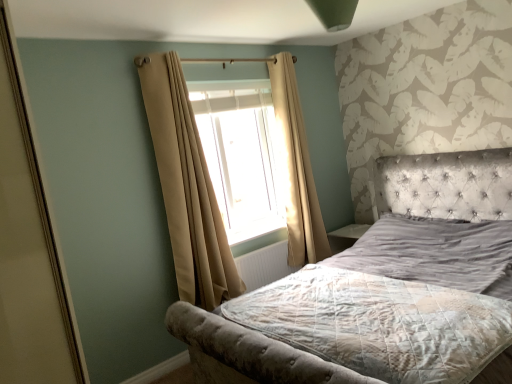
Question: From the image's perspective, is white textured radiator at center positioned above or below velvet grey bed at center?

Choices:
 (A) below
 (B) above

Answer: (A)

Question: Is white textured radiator at center taller or shorter than velvet grey bed at center?

Choices:
 (A) tall
 (B) short

Answer: (B)

Question: Which object is the farthest from the translucent fabric window at center?

Choices:
 (A) beige fabric curtain at left, which is counted as the 2th curtain, starting from the back
 (B) beige fabric curtain at center, which is counted as the first curtain, starting from the back
 (C) textured gray mattress at center
 (D) white textured radiator at center
 (E) velvet grey bed at center

Answer: (C)

Question: Estimate the real-world distances between objects in this image. Which object is farther from the velvet grey bed at center?

Choices:
 (A) beige fabric curtain at left, the 2th curtain from the right
 (B) textured gray mattress at center
 (C) translucent fabric window at center
 (D) white textured radiator at center
 (E) beige fabric curtain at center, which is counted as the first curtain, starting from the back

Answer: (C)